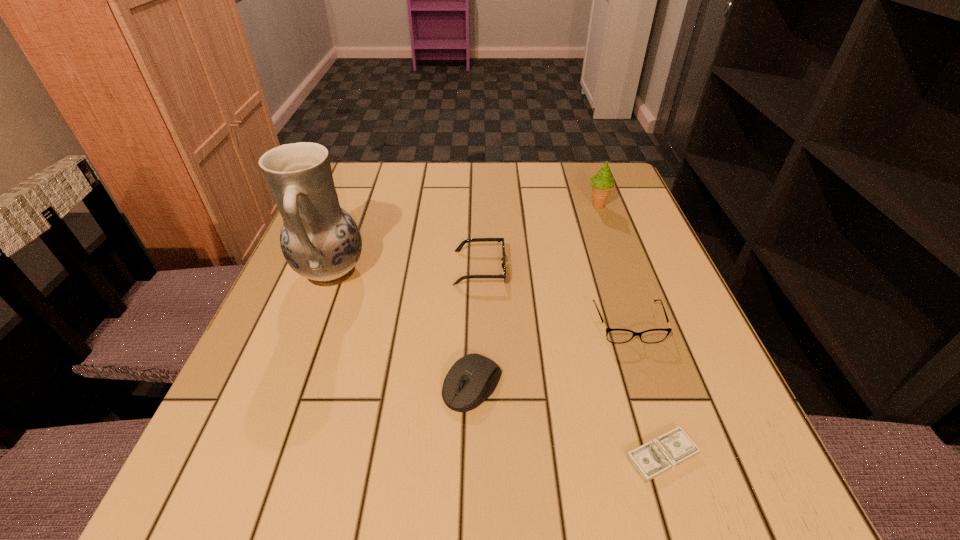
Locate an element on the screen. The image size is (960, 540). object that is the fourth closest to the spectacles is located at coordinates (602, 183).

Identify the location of object that ranks as the second closest to the sunglasses. Image resolution: width=960 pixels, height=540 pixels. (473, 378).

Find the location of a particular element. This screenshot has height=540, width=960. vacant space that satisfies the following two spatial constraints: 1. on the front-facing side of the sunglasses; 2. on the back side of the money is located at coordinates (480, 456).